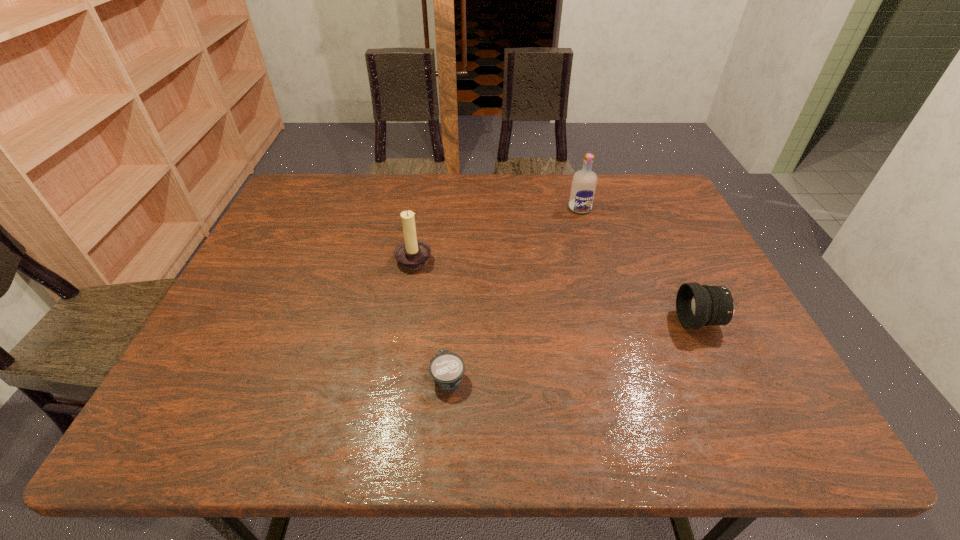
The image size is (960, 540). Find the location of `vacant space at the near right corner`. vacant space at the near right corner is located at coordinates (804, 421).

Find the location of a particular element. The height and width of the screenshot is (540, 960). blank region between the second object from right to left and the rightmost object is located at coordinates (639, 265).

The width and height of the screenshot is (960, 540). What are the coordinates of `vacant space that's between the telephoto lens and the leftmost object` in the screenshot? It's located at (557, 289).

The image size is (960, 540). In order to click on empty space between the third nearest object and the second nearest object in this screenshot , I will do `click(557, 289)`.

Where is `free point between the rightmost object and the vodka`? free point between the rightmost object and the vodka is located at coordinates (639, 265).

In order to click on vacant space in between the telephoto lens and the second object from left to right in this screenshot , I will do `click(574, 349)`.

Locate an element on the screen. free point between the second object from left to right and the leftmost object is located at coordinates (431, 318).

I want to click on free space between the third tallest object and the leftmost object, so click(557, 289).

At what (x,y) coordinates should I click in order to perform the action: click on vacant space that is in between the leftmost object and the third object from right to left. Please return your answer as a coordinate pair (x, y). Looking at the image, I should click on (431, 318).

Locate an element on the screen. This screenshot has height=540, width=960. vacant space that's between the third nearest object and the yogurt is located at coordinates (431, 318).